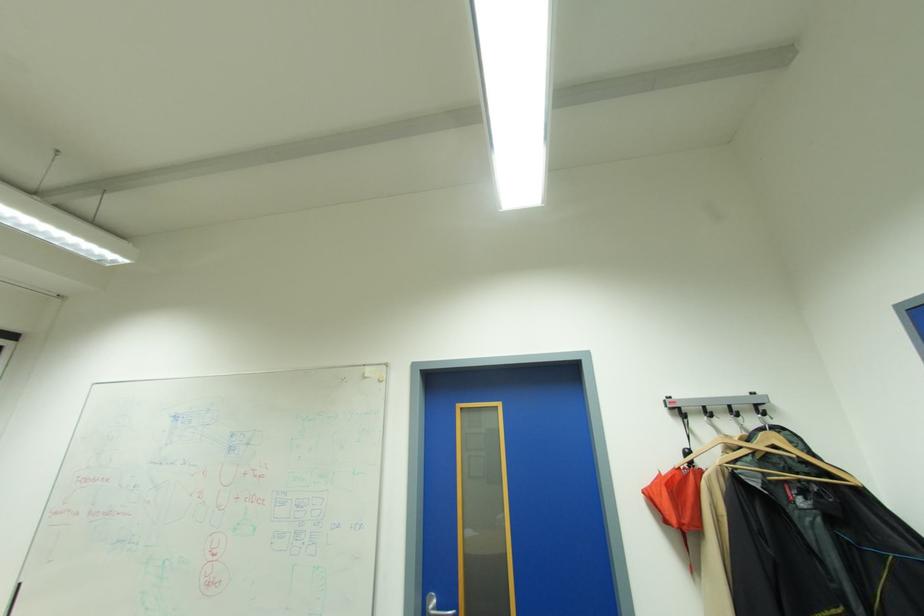
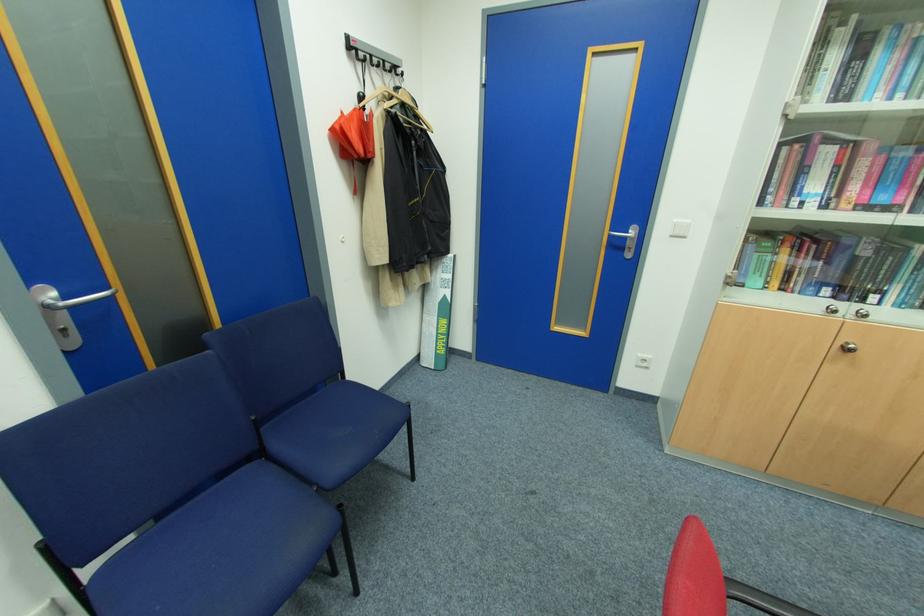
Find the pixel in the second image that matches (x=713, y=410) in the first image.

(380, 60)